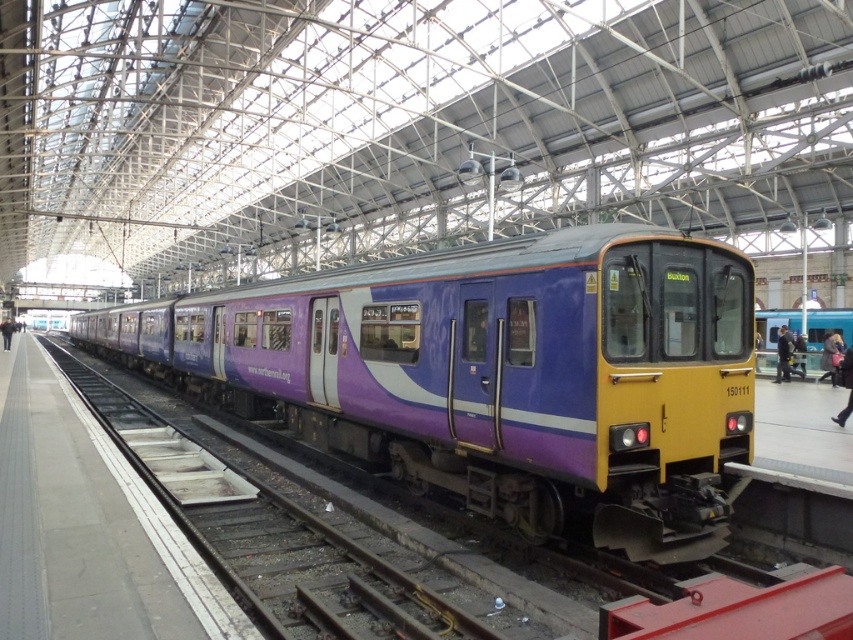
You are standing at the train station and see the purple glossy train at center. There is a point marked at coordinates (x=496, y=374). Where is this point located?

The point marked at coordinates (x=496, y=374) is located on the purple glossy train at center.

You are a passenger waiting on the platform and see the purple glossy train at center and the dark blue jacket at center. Which object is closer to the edge of the platform?

The purple glossy train at center is positioned on the left side of dark blue jacket at center, so the dark blue jacket at center is closer to the edge of the platform.